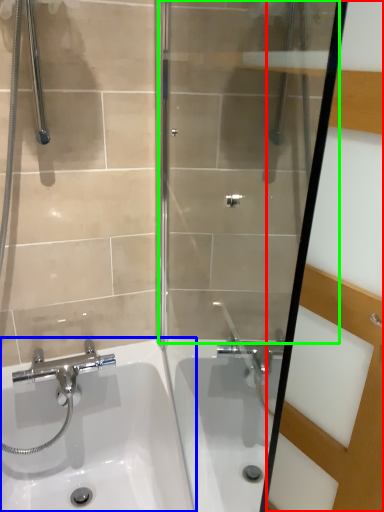
Question: Considering the real-world distances, which object is closest to screen door (highlighted by a red box)? sink (highlighted by a blue box) or shower door (highlighted by a green box).

Choices:
 (A) sink
 (B) shower door

Answer: (B)